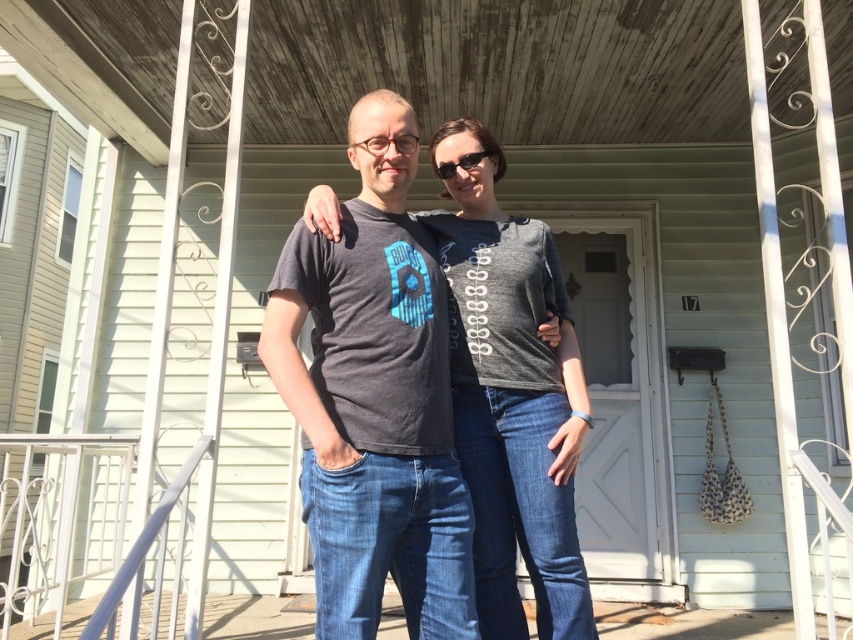
Question: Does dark gray t-shirt at center come in front of black plastic sunglasses at center?

Choices:
 (A) no
 (B) yes

Answer: (B)

Question: Which object is closer to the camera taking this photo?

Choices:
 (A) dark gray t-shirt at center
 (B) black plastic sunglasses at center

Answer: (A)

Question: Which point is closer to the camera?

Choices:
 (A) [x=476, y=161]
 (B) [x=422, y=340]

Answer: (B)

Question: Considering the relative positions of dark gray t-shirt at center and black plastic sunglasses at center in the image provided, where is dark gray t-shirt at center located with respect to black plastic sunglasses at center?

Choices:
 (A) above
 (B) below

Answer: (B)

Question: Can you confirm if dark gray t-shirt at center is smaller than black plastic sunglasses at center?

Choices:
 (A) yes
 (B) no

Answer: (B)